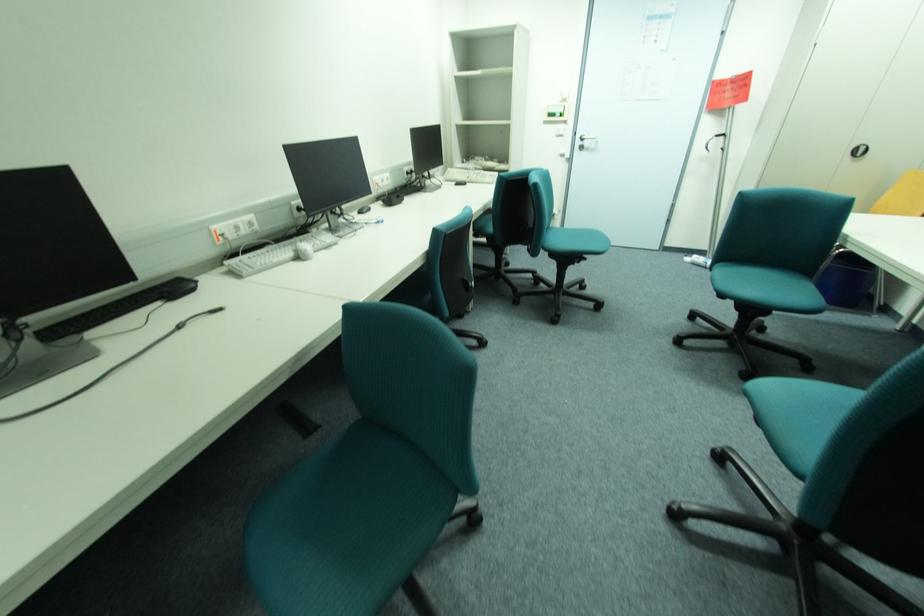
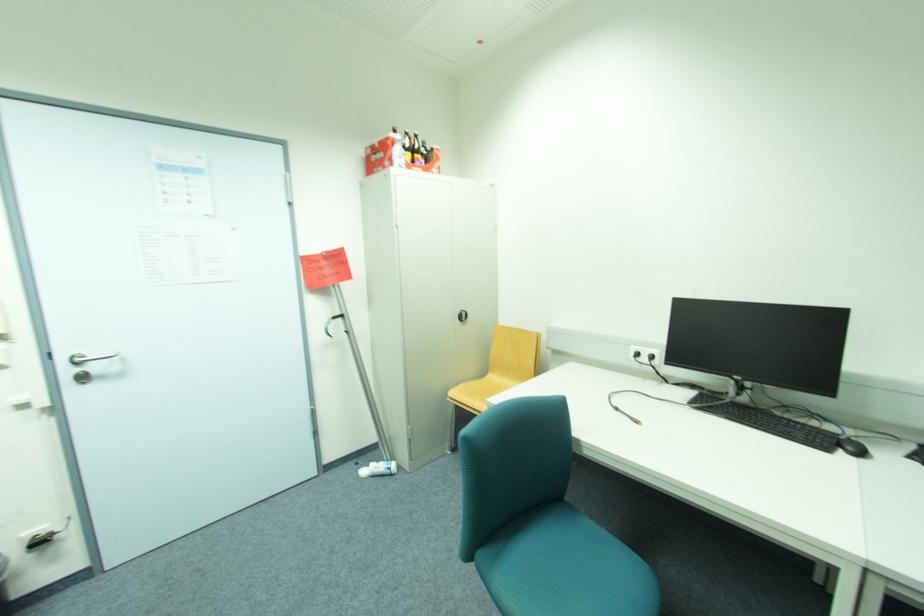
The point at (699, 257) is marked in the first image. Where is the corresponding point in the second image?

(373, 468)